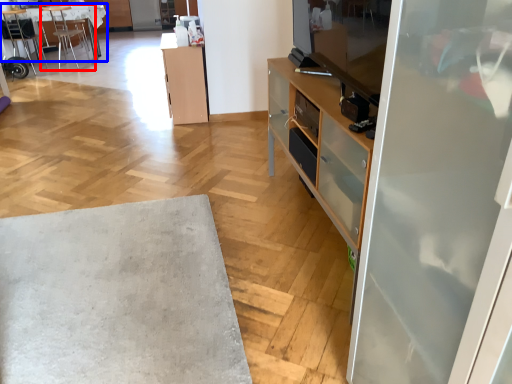
Question: Which object appears closest to the camera in this image, chair (highlighted by a red box) or desk (highlighted by a blue box)?

Choices:
 (A) chair
 (B) desk

Answer: (A)